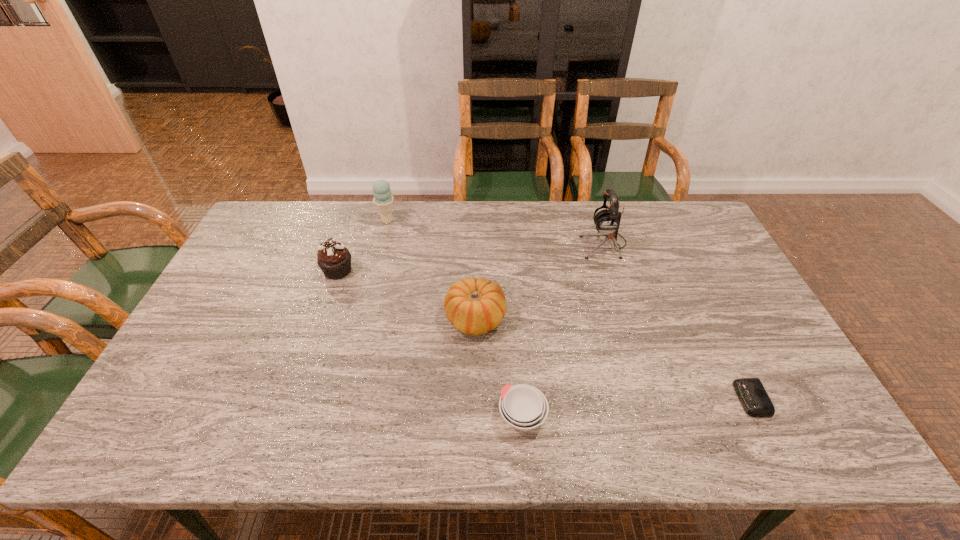
Find the location of a particular element. The image size is (960, 540). soup bowl at the near edge is located at coordinates click(x=524, y=407).

What are the coordinates of `alarm clock at the near edge` in the screenshot? It's located at (750, 391).

Locate an element on the screen. object located in the right edge section of the desktop is located at coordinates (750, 391).

You are a GUI agent. You are given a task and a screenshot of the screen. Output one action in this format:
    pyautogui.click(x=<x>, y=<y>)
    Task: Click on the object situated at the near right corner
    The image size is (960, 540).
    Given the screenshot: What is the action you would take?
    pyautogui.click(x=750, y=391)

Where is `free space at the far edge of the desktop`? Image resolution: width=960 pixels, height=540 pixels. free space at the far edge of the desktop is located at coordinates click(461, 235).

I want to click on vacant space at the near edge of the desktop, so click(x=458, y=450).

This screenshot has width=960, height=540. Find the location of `vacant space at the left edge of the desktop`. vacant space at the left edge of the desktop is located at coordinates (253, 300).

This screenshot has width=960, height=540. In order to click on vacant region at the right edge of the desktop in this screenshot , I will do `click(736, 306)`.

This screenshot has width=960, height=540. In the image, there is a desktop. What are the coordinates of `vacant space at the near left corner` in the screenshot? It's located at (170, 451).

Find the location of a particular element. The image size is (960, 540). vacant space at the far right corner of the desktop is located at coordinates (661, 224).